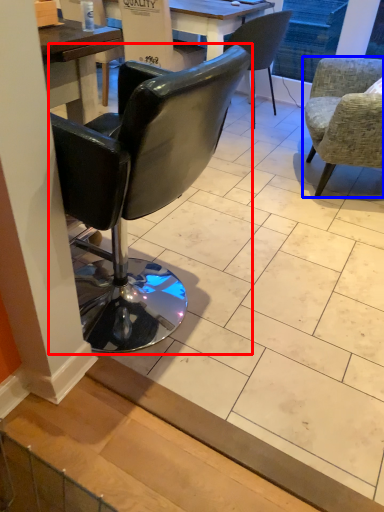
Question: Which point is closer to the camera, chair (highlighted by a red box) or chair (highlighted by a blue box)?

Choices:
 (A) chair
 (B) chair

Answer: (A)